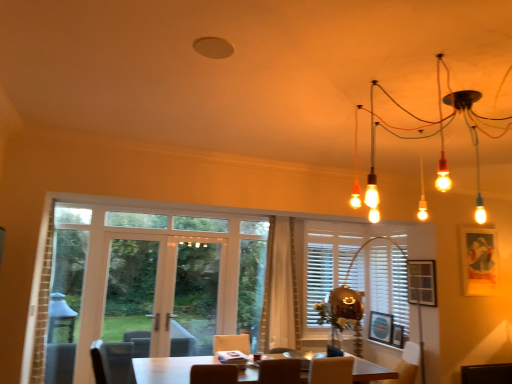
What do you see at coordinates (437, 134) in the screenshot? The image size is (512, 384). I see `matte black chandelier at upper right` at bounding box center [437, 134].

Where is `wooden picture frame at center, the fourth picture frame from the right`? The height and width of the screenshot is (384, 512). wooden picture frame at center, the fourth picture frame from the right is located at coordinates (381, 327).

You are a GUI agent. You are given a task and a screenshot of the screen. Output one action in this format:
    pyautogui.click(x=<x>, y=<y>)
    Task: Click on the wooden picture frame at right, acting as the second picture frame starting from the right
    Image resolution: width=512 pixels, height=384 pixels.
    Given the screenshot: What is the action you would take?
    pyautogui.click(x=422, y=282)

Does white wooden shutter at left have a lesser height compared to matte black picture frame at upper right, which is the 4th picture frame in left-to-right order?

No, white wooden shutter at left is not shorter than matte black picture frame at upper right, which is the 4th picture frame in left-to-right order.

Between point (29, 326) and point (476, 243), which one is positioned in front?

The point (29, 326) is more forward.

How much distance is there between white wooden shutter at left and matte black picture frame at upper right, the first picture frame from the right?

white wooden shutter at left is 4.25 meters away from matte black picture frame at upper right, the first picture frame from the right.

Considering the relative sizes of white wooden shutter at left and matte black picture frame at upper right, which is the 4th picture frame in left-to-right order, in the image provided, is white wooden shutter at left bigger than matte black picture frame at upper right, which is the 4th picture frame in left-to-right order,?

Yes.

In order to click on table below the wooden picture frame at center, the 1th picture frame viewed from the left (from a real-world perspective) in this screenshot , I will do `click(167, 369)`.

Is white glossy table at center to the left of wooden picture frame at center, the fourth picture frame from the right, from the viewer's perspective?

Correct, you'll find white glossy table at center to the left of wooden picture frame at center, the fourth picture frame from the right.

Is white glossy table at center further to the viewer compared to wooden picture frame at center, the fourth picture frame from the right?

No, it is not.

Considering the relative sizes of white glossy table at center and wooden picture frame at center, the 1th picture frame viewed from the left, in the image provided, is white glossy table at center taller than wooden picture frame at center, the 1th picture frame viewed from the left,?

→ Indeed, white glossy table at center has a greater height compared to wooden picture frame at center, the 1th picture frame viewed from the left.

Considering the sizes of objects white glass door at center, the first screen door viewed from the right, and wooden screen door at left, which is counted as the 2th screen door, starting from the right, in the image provided, who is thinner, white glass door at center, the first screen door viewed from the right, or wooden screen door at left, which is counted as the 2th screen door, starting from the right,?

With smaller width is wooden screen door at left, which is counted as the 2th screen door, starting from the right.

Which object is positioned more to the right, white glass door at center, the first screen door viewed from the right, or wooden screen door at left, positioned as the 1th screen door in left-to-right order?

Positioned to the right is white glass door at center, the first screen door viewed from the right.

From a real-world perspective, who is located higher, white glass door at center, the first screen door viewed from the right, or wooden screen door at left, which is counted as the 2th screen door, starting from the right?

From a 3D spatial view, white glass door at center, the first screen door viewed from the right, is above.

Which point is more forward, (x=207, y=257) or (x=137, y=266)?

The point (x=137, y=266) is in front.

Is matte black picture frame at upper right, the first picture frame from the right, closer to camera compared to orange fabric armchair at lower right?

No, matte black picture frame at upper right, the first picture frame from the right, is further to the viewer.

Is point (472, 263) positioned in front of point (414, 346)?

Yes, point (472, 263) is in front of point (414, 346).

How many degrees apart are the facing directions of matte black picture frame at upper right, which is the 4th picture frame in left-to-right order, and orange fabric armchair at lower right?

The angle between the facing direction of matte black picture frame at upper right, which is the 4th picture frame in left-to-right order, and the facing direction of orange fabric armchair at lower right is 97 degrees.

In the image, is white wooden shutter at left positioned in front of or behind wooden screen door at left, positioned as the 1th screen door in left-to-right order?

Clearly, white wooden shutter at left is in front of wooden screen door at left, positioned as the 1th screen door in left-to-right order.

Considering the sizes of white wooden shutter at left and wooden screen door at left, positioned as the 1th screen door in left-to-right order, in the image, is white wooden shutter at left bigger or smaller than wooden screen door at left, positioned as the 1th screen door in left-to-right order,?

white wooden shutter at left is bigger than wooden screen door at left, positioned as the 1th screen door in left-to-right order.

Locate an element on the screen. the 2nd picture frame directly above the white sheer curtain at center (from a real-world perspective) is located at coordinates (479, 261).

Is matte black picture frame at upper right, which is the 4th picture frame in left-to-right order, not close to white sheer curtain at center?

Indeed, matte black picture frame at upper right, which is the 4th picture frame in left-to-right order, is not near white sheer curtain at center.

Is matte black picture frame at upper right, the first picture frame from the right, inside or outside of white sheer curtain at center?

matte black picture frame at upper right, the first picture frame from the right, lies outside white sheer curtain at center.

Considering the relative sizes of matte black picture frame at upper right, the first picture frame from the right, and white sheer curtain at center in the image provided, is matte black picture frame at upper right, the first picture frame from the right, bigger than white sheer curtain at center?

Incorrect, matte black picture frame at upper right, the first picture frame from the right, is not larger than white sheer curtain at center.

Is white glossy table at center far from clear glass door at center?

No, white glossy table at center is not far from clear glass door at center.

Which object is more forward, white glossy table at center or clear glass door at center?

white glossy table at center is more forward.

The image size is (512, 384). Identify the location of window screen on the left of white glossy table at center. (195, 299).

Would you say white glossy table at center is inside or outside clear glass door at center?

white glossy table at center cannot be found inside clear glass door at center.

At what (x,y) coordinates should I click in order to perform the action: click on shutter below the matte black picture frame at upper right, which is the 4th picture frame in left-to-right order (from the image's perspective). Please return your answer as a coordinate pair (x, y). The width and height of the screenshot is (512, 384). Looking at the image, I should click on (39, 302).

The width and height of the screenshot is (512, 384). Identify the location of the 1st picture frame positioned above the white glossy table at center (from the image's perspective). (381, 327).

Which object lies nearer to the anchor point white matte blinds at center, wooden picture frame at lower right, which appears as the 2th picture frame when viewed from the left, or wooden picture frame at center, the 1th picture frame viewed from the left?

Among the two, wooden picture frame at center, the 1th picture frame viewed from the left, is located nearer to white matte blinds at center.

When comparing their distances from wooden picture frame at lower right, which appears as the 2th picture frame when viewed from the left, does white glossy table at center or wooden screen door at left, positioned as the 1th screen door in left-to-right order, seem further?

wooden screen door at left, positioned as the 1th screen door in left-to-right order, lies further to wooden picture frame at lower right, which appears as the 2th picture frame when viewed from the left, than the other object.

Estimate the real-world distances between objects in this image. Which object is further from white glossy table at center, clear glass door at center or white sheer curtain at center?

Among the two, white sheer curtain at center is located further to white glossy table at center.

Considering their positions, is clear glass door at center positioned closer to white matte blinds at center than matte black chandelier at upper right?

clear glass door at center is positioned closer to the anchor white matte blinds at center.

Looking at this image, estimate the real-world distances between objects in this image. Which object is closer to white glass door at center, the first screen door viewed from the right, matte black picture frame at upper right, which is the 4th picture frame in left-to-right order, or wooden picture frame at lower right, which appears as the 2th picture frame when viewed from the left?

Based on the image, wooden picture frame at lower right, which appears as the 2th picture frame when viewed from the left, appears to be nearer to white glass door at center, the first screen door viewed from the right.

Based on their spatial positions, is wooden picture frame at center, the 1th picture frame viewed from the left, or matte black chandelier at upper right further from clear glass door at center?

Among the two, matte black chandelier at upper right is located further to clear glass door at center.

Based on the photo, looking at the image, which one is located further to wooden picture frame at center, the 1th picture frame viewed from the left, white matte blinds at center or wooden screen door at left, which is counted as the 2th screen door, starting from the right?

Among the two, wooden screen door at left, which is counted as the 2th screen door, starting from the right, is located further to wooden picture frame at center, the 1th picture frame viewed from the left.

Based on their spatial positions, is orange fabric armchair at lower right or clear glass door at center closer to wooden picture frame at lower right, marked as the third picture frame in a right-to-left arrangement?

orange fabric armchair at lower right.

You are a GUI agent. You are given a task and a screenshot of the screen. Output one action in this format:
    pyautogui.click(x=<x>, y=<y>)
    Task: Click on the window between clear glass door at center and orange fabric armchair at lower right from left to right
    Image resolution: width=512 pixels, height=384 pixels.
    Given the screenshot: What is the action you would take?
    [x=336, y=257]

Identify the location of curtain between wooden screen door at left, which is counted as the 2th screen door, starting from the right, and white matte blinds at center, in the horizontal direction. point(280,289).

Where is `window screen situated between white wooden shutter at left and matte black picture frame at upper right, the first picture frame from the right, from left to right`? window screen situated between white wooden shutter at left and matte black picture frame at upper right, the first picture frame from the right, from left to right is located at coordinates (195, 299).

Find the location of `screen door between wooden screen door at left, which is counted as the 2th screen door, starting from the right, and wooden picture frame at right, acting as the second picture frame starting from the right`. screen door between wooden screen door at left, which is counted as the 2th screen door, starting from the right, and wooden picture frame at right, acting as the second picture frame starting from the right is located at coordinates (160, 300).